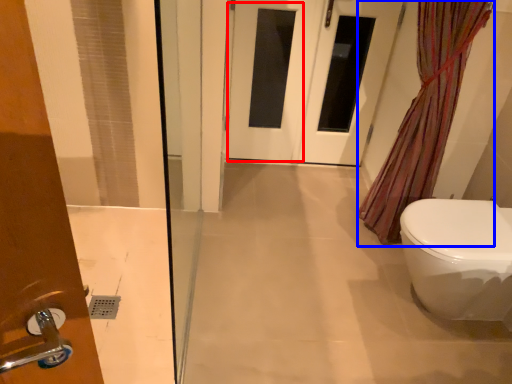
Question: Which of the following is the farthest to the observer, screen door (highlighted by a red box) or shower curtain (highlighted by a blue box)?

Choices:
 (A) screen door
 (B) shower curtain

Answer: (A)